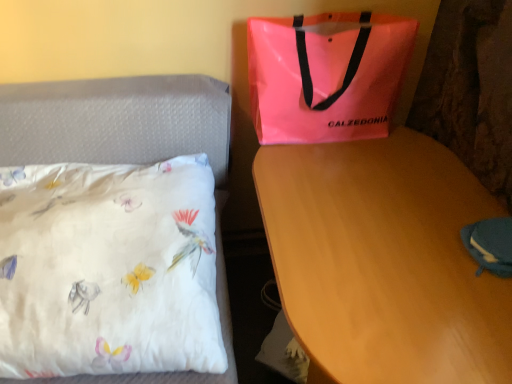
Question: From a real-world perspective, is neon pink plastic bag at upper right physically below blue fabric pouch at lower right?

Choices:
 (A) no
 (B) yes

Answer: (A)

Question: Is neon pink plastic bag at upper right facing towards blue fabric pouch at lower right?

Choices:
 (A) no
 (B) yes

Answer: (B)

Question: Is neon pink plastic bag at upper right in contact with blue fabric pouch at lower right?

Choices:
 (A) yes
 (B) no

Answer: (B)

Question: From the image's perspective, is neon pink plastic bag at upper right above blue fabric pouch at lower right?

Choices:
 (A) no
 (B) yes

Answer: (B)

Question: Considering the relative positions of neon pink plastic bag at upper right and blue fabric pouch at lower right in the image provided, is neon pink plastic bag at upper right to the left of blue fabric pouch at lower right from the viewer's perspective?

Choices:
 (A) no
 (B) yes

Answer: (B)

Question: Can blue fabric pouch at lower right be found inside neon pink plastic bag at upper right?

Choices:
 (A) yes
 (B) no

Answer: (B)

Question: Is blue fabric pouch at lower right inside wooden desk at center?

Choices:
 (A) no
 (B) yes

Answer: (B)

Question: Does wooden desk at center have a greater height compared to blue fabric pouch at lower right?

Choices:
 (A) yes
 (B) no

Answer: (A)

Question: Is wooden desk at center in front of blue fabric pouch at lower right?

Choices:
 (A) yes
 (B) no

Answer: (A)

Question: From the image's perspective, is wooden desk at center beneath blue fabric pouch at lower right?

Choices:
 (A) no
 (B) yes

Answer: (B)

Question: From a real-world perspective, is wooden desk at center physically below blue fabric pouch at lower right?

Choices:
 (A) yes
 (B) no

Answer: (A)

Question: Does wooden desk at center have a lesser width compared to blue fabric pouch at lower right?

Choices:
 (A) yes
 (B) no

Answer: (B)

Question: Is white satin pillow at left far away from blue fabric pouch at lower right?

Choices:
 (A) no
 (B) yes

Answer: (A)